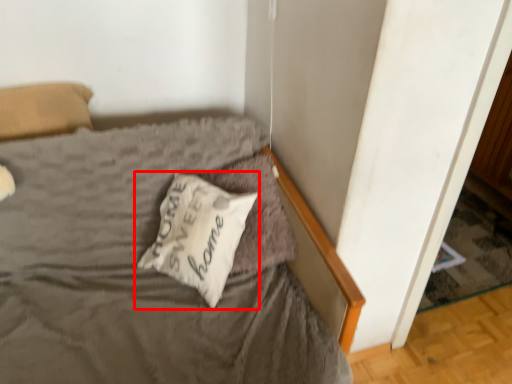
Question: From the image, what is the correct spatial relationship of pillow (annotated by the red box) in relation to pillow?

Choices:
 (A) left
 (B) right

Answer: (A)